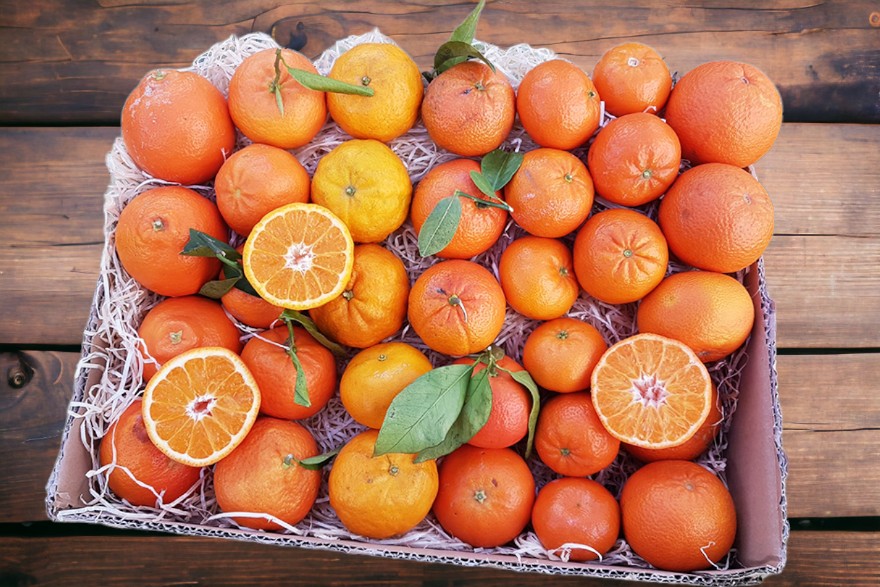
Find the location of `wooden table planks`. wooden table planks is located at coordinates (824, 38), (817, 194), (826, 377), (836, 560).